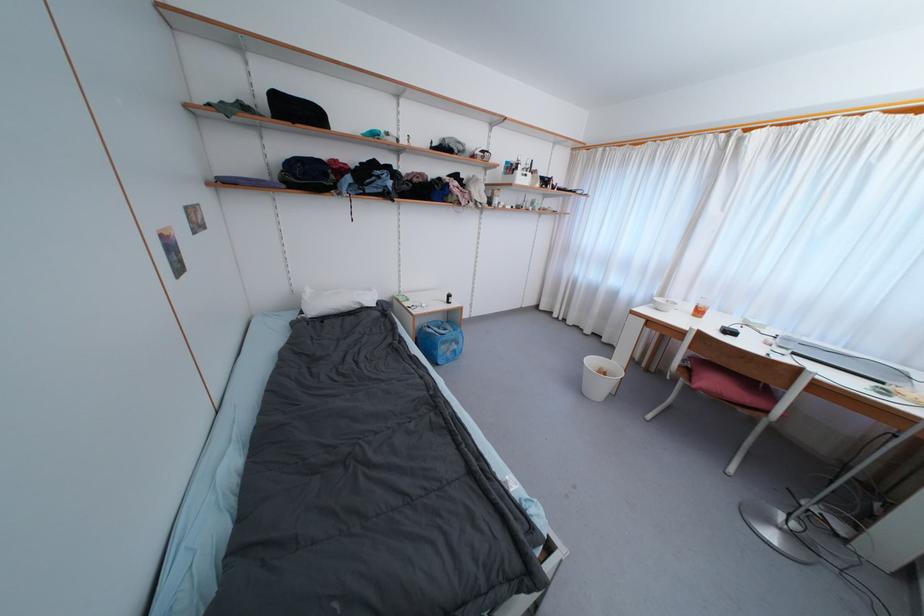
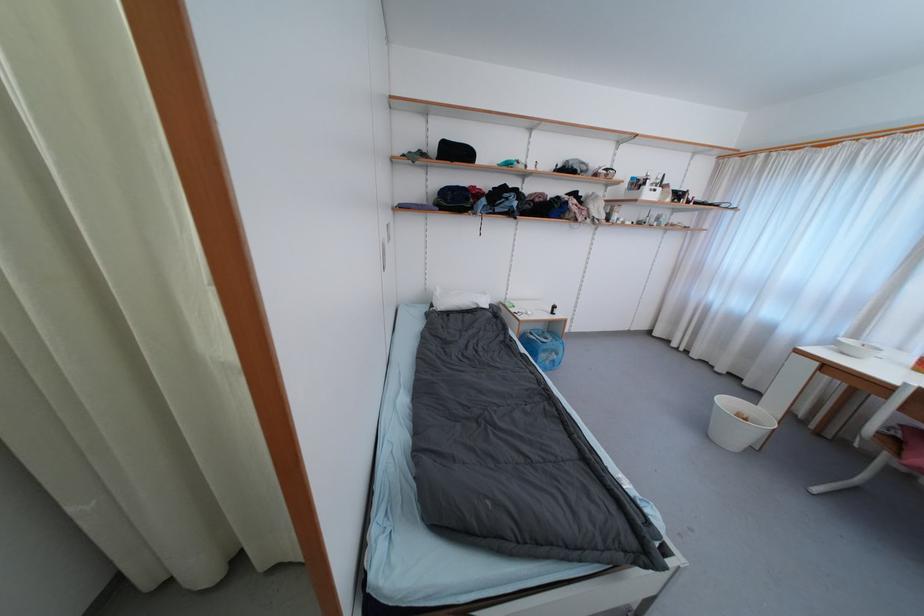
Locate, in the second image, the point that corresponds to pixel 432 330 in the first image.

(535, 336)